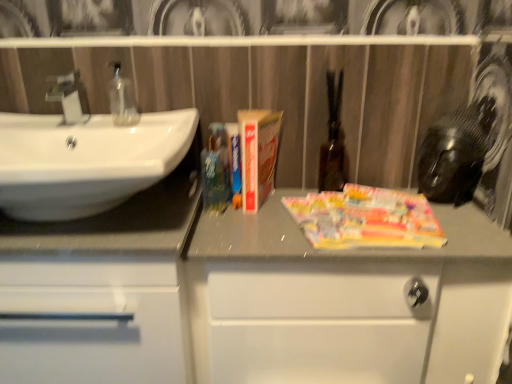
The image size is (512, 384). Find the location of `free spot in front of hardcover book at center`. free spot in front of hardcover book at center is located at coordinates (253, 228).